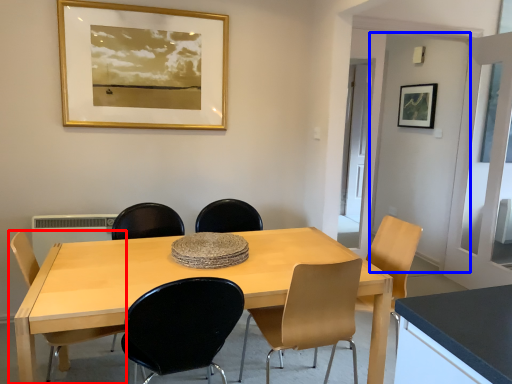
Question: Which object is further to the camera taking this photo, chair (highlighted by a red box) or door (highlighted by a blue box)?

Choices:
 (A) chair
 (B) door

Answer: (B)